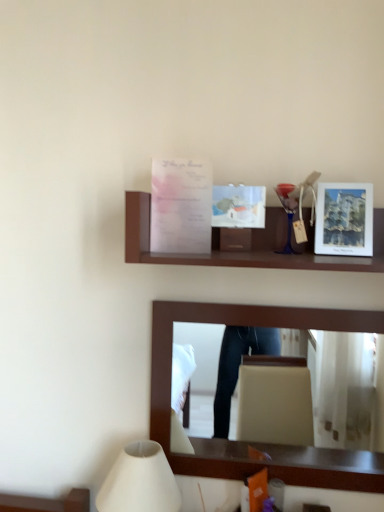
Question: Considering the positions of translucent paper postcard at upper center and brown wooden mirror at upper center in the image, is translucent paper postcard at upper center taller or shorter than brown wooden mirror at upper center?

Choices:
 (A) short
 (B) tall

Answer: (A)

Question: From the image's perspective, is translucent paper postcard at upper center located above or below brown wooden mirror at upper center?

Choices:
 (A) above
 (B) below

Answer: (A)

Question: Estimate the real-world distances between objects in this image. Which object is closer to the translucent paper postcard at upper center?

Choices:
 (A) white matte lampshade at lower left
 (B) matte white picture frame at right
 (C) brown wooden mirror at upper center
 (D) wooden shelf at center

Answer: (D)

Question: Which of these objects is positioned closest to the white matte lampshade at lower left?

Choices:
 (A) wooden shelf at center
 (B) matte white picture frame at right
 (C) translucent paper postcard at upper center
 (D) brown wooden mirror at upper center

Answer: (D)